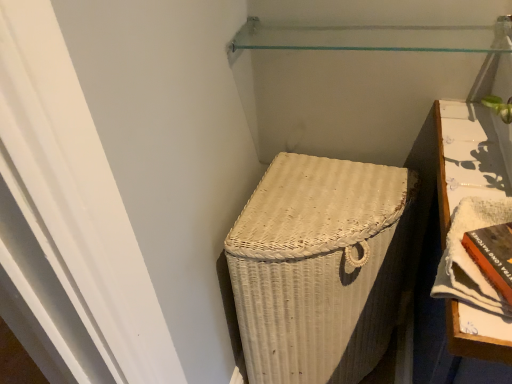
Question: Based on their sizes in the image, would you say orange hardcover book at lower right, the 2th book from the right, is bigger or smaller than transparent glass shelf at upper center?

Choices:
 (A) small
 (B) big

Answer: (A)

Question: From the image's perspective, is orange hardcover book at lower right, which appears as the 1th book when viewed from the left, above or below transparent glass shelf at upper center?

Choices:
 (A) above
 (B) below

Answer: (B)

Question: Which object is positioned farthest from the transparent glass shelf at upper center?

Choices:
 (A) white wicker basket at lower right
 (B) orange hardcover book at right, positioned as the 1th book in right-to-left order
 (C) orange hardcover book at lower right, the 2th book from the right

Answer: (C)

Question: Which of these objects is positioned closest to the orange hardcover book at lower right, which appears as the 1th book when viewed from the left?

Choices:
 (A) orange hardcover book at right, marked as the second book in a left-to-right arrangement
 (B) transparent glass shelf at upper center
 (C) white wicker basket at lower right

Answer: (A)